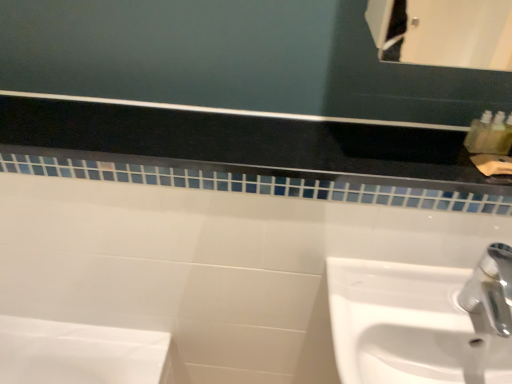
Question: Can you see white glossy sink at lower right touching white glossy tile at upper center?

Choices:
 (A) yes
 (B) no

Answer: (B)

Question: Does white glossy sink at lower right appear on the right side of white glossy tile at upper center?

Choices:
 (A) no
 (B) yes

Answer: (B)

Question: Can white glossy tile at upper center be found inside white glossy sink at lower right?

Choices:
 (A) no
 (B) yes

Answer: (A)

Question: Is the position of white glossy sink at lower right more distant than that of white glossy tile at upper center?

Choices:
 (A) yes
 (B) no

Answer: (B)

Question: From the image's perspective, is white glossy sink at lower right above white glossy tile at upper center?

Choices:
 (A) no
 (B) yes

Answer: (A)

Question: Could you tell me if white glossy sink at lower right is turned towards white glossy tile at upper center?

Choices:
 (A) yes
 (B) no

Answer: (B)

Question: From a real-world perspective, is white glossy tile at upper center below white glossy sink at lower right?

Choices:
 (A) no
 (B) yes

Answer: (A)

Question: From the image's perspective, does white glossy tile at upper center appear higher than white glossy sink at lower right?

Choices:
 (A) yes
 (B) no

Answer: (A)

Question: Is white glossy tile at upper center facing towards white glossy sink at lower right?

Choices:
 (A) no
 (B) yes

Answer: (A)

Question: Is white glossy tile at upper center thinner than white glossy sink at lower right?

Choices:
 (A) yes
 (B) no

Answer: (A)

Question: Can you confirm if white glossy tile at upper center is taller than white glossy sink at lower right?

Choices:
 (A) no
 (B) yes

Answer: (A)

Question: Considering the relative positions of white glossy tile at upper center and white glossy sink at lower right in the image provided, is white glossy tile at upper center to the right of white glossy sink at lower right from the viewer's perspective?

Choices:
 (A) yes
 (B) no

Answer: (B)

Question: From a real-world perspective, is white glossy tile at upper center positioned above or below white glossy sink at lower right?

Choices:
 (A) below
 (B) above

Answer: (B)